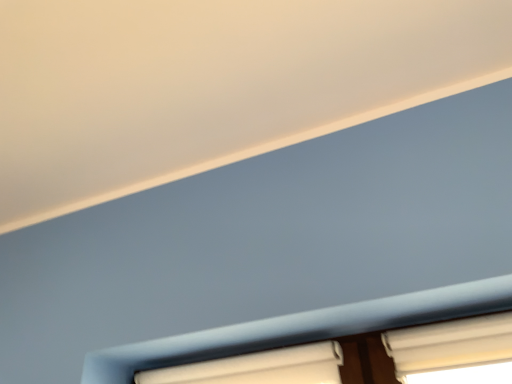
Question: Can you confirm if white textured blinds at lower right, the first window positioned from the right, is thinner than white matte window at lower center, which is the second window from right to left?

Choices:
 (A) no
 (B) yes

Answer: (A)

Question: Is white textured blinds at lower right, the first window positioned from the right, taller than white matte window at lower center, which is the second window from right to left?

Choices:
 (A) no
 (B) yes

Answer: (B)

Question: Considering the relative positions of white textured blinds at lower right, the first window positioned from the right, and white matte window at lower center, which appears as the first window when viewed from the left, in the image provided, is white textured blinds at lower right, the first window positioned from the right, in front of white matte window at lower center, which appears as the first window when viewed from the left,?

Choices:
 (A) no
 (B) yes

Answer: (B)

Question: Can you confirm if white textured blinds at lower right, which is the second window from left to right, is shorter than white matte window at lower center, which appears as the first window when viewed from the left?

Choices:
 (A) yes
 (B) no

Answer: (B)

Question: Are white textured blinds at lower right, which is the second window from left to right, and white matte window at lower center, which appears as the first window when viewed from the left, beside each other?

Choices:
 (A) yes
 (B) no

Answer: (B)

Question: Is white textured blinds at lower right, the first window positioned from the right, further to the viewer compared to white matte window at lower center, which appears as the first window when viewed from the left?

Choices:
 (A) yes
 (B) no

Answer: (B)

Question: Is white matte window at lower center, which appears as the first window when viewed from the left, facing towards white textured blinds at lower right, the first window positioned from the right?

Choices:
 (A) yes
 (B) no

Answer: (B)

Question: Does white matte window at lower center, which is the second window from right to left, have a greater height compared to white textured blinds at lower right, which is the second window from left to right?

Choices:
 (A) no
 (B) yes

Answer: (A)

Question: Is white matte window at lower center, which is the second window from right to left, facing away from white textured blinds at lower right, which is the second window from left to right?

Choices:
 (A) yes
 (B) no

Answer: (B)

Question: Is white matte window at lower center, which appears as the first window when viewed from the left, positioned before white textured blinds at lower right, which is the second window from left to right?

Choices:
 (A) no
 (B) yes

Answer: (A)

Question: Is white matte window at lower center, which is the second window from right to left, next to white textured blinds at lower right, which is the second window from left to right, and touching it?

Choices:
 (A) yes
 (B) no

Answer: (B)

Question: Is white matte window at lower center, which is the second window from right to left, smaller than white textured blinds at lower right, which is the second window from left to right?

Choices:
 (A) no
 (B) yes

Answer: (A)

Question: Is white matte window at lower center, which is the second window from right to left, inside or outside of white textured blinds at lower right, the first window positioned from the right?

Choices:
 (A) outside
 (B) inside

Answer: (A)